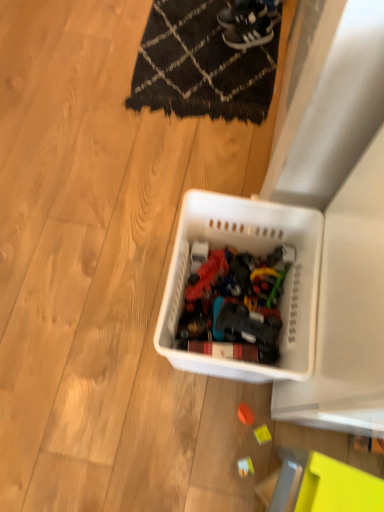
Identify the location of vacant area that lies between white plastic basket at center and orange matte ball at center, acting as the 3th toy starting from the bottom. (223, 396).